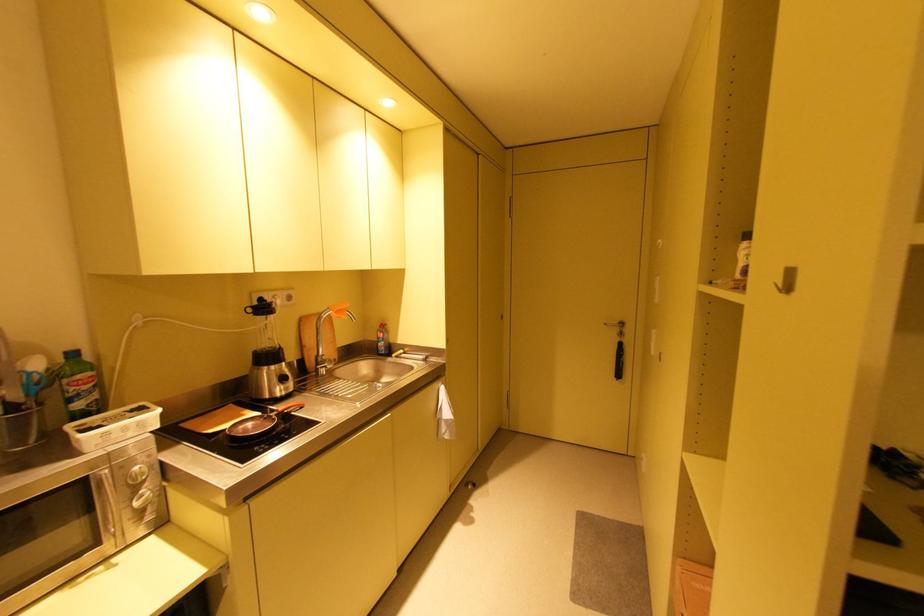
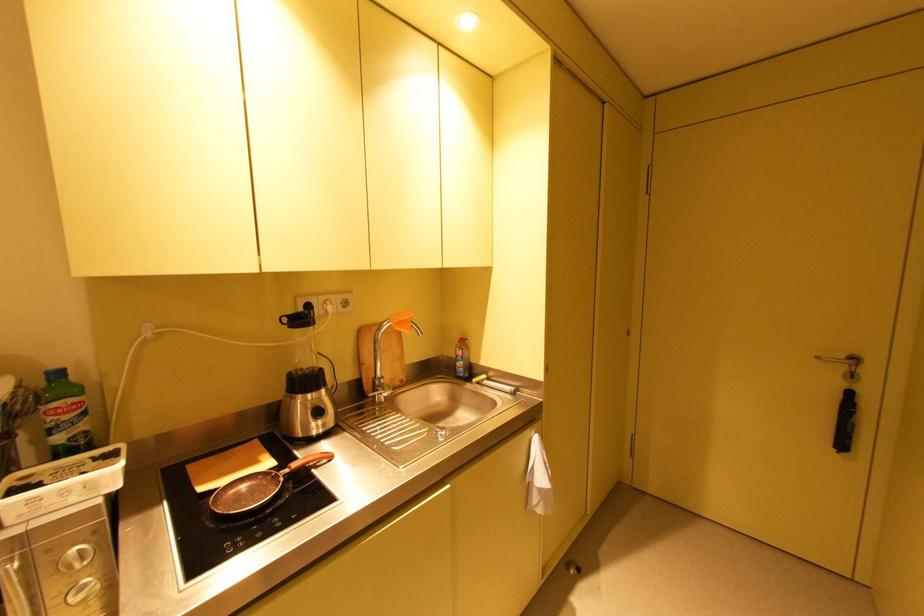
Question: The camera is either moving clockwise (left) or counter-clockwise (right) around the object. The first image is from the beginning of the video and the second image is from the end. Is the camera moving left or right when shooting the video?

Choices:
 (A) Left
 (B) Right

Answer: (B)